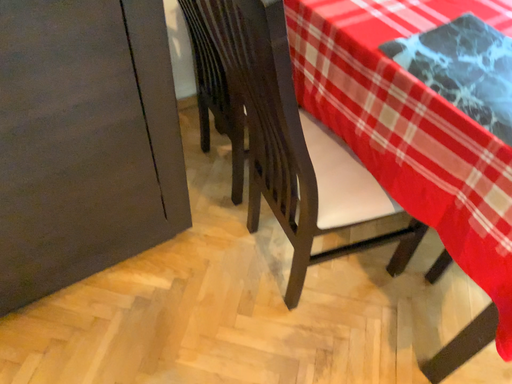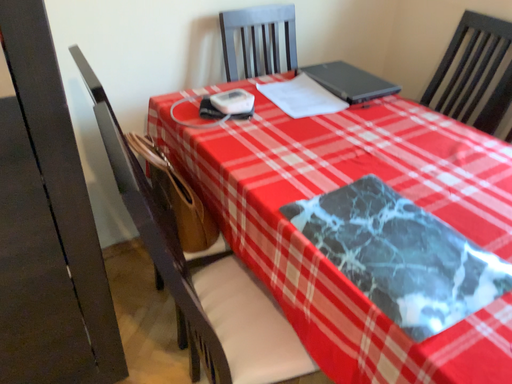
Question: Which way did the camera rotate in the video?

Choices:
 (A) rotated downward
 (B) rotated upward

Answer: (B)